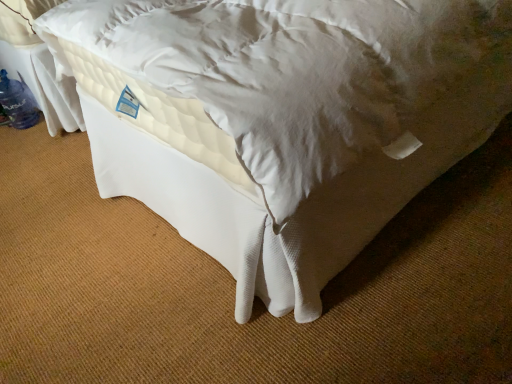
Locate an element on the screen. blue fabric bag at lower left is located at coordinates (17, 103).

What do you see at coordinates (17, 103) in the screenshot?
I see `blue fabric bag at lower left` at bounding box center [17, 103].

I want to click on blue fabric bag at lower left, so click(x=17, y=103).